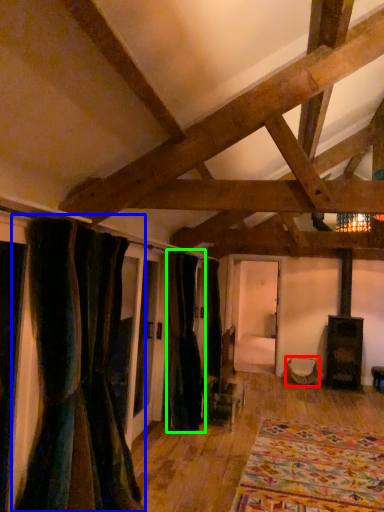
Question: Which object is the farthest from furniture (highlighted by a red box)? Choose among these: curtain (highlighted by a blue box) or curtain (highlighted by a green box).

Choices:
 (A) curtain
 (B) curtain

Answer: (A)